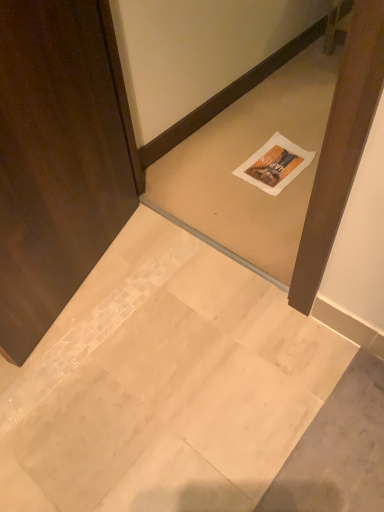
You are a GUI agent. You are given a task and a screenshot of the screen. Output one action in this format:
    pyautogui.click(x=<x>, y=<y>)
    Task: Click on the white paper magazine at center
    Image resolution: width=384 pixels, height=512 pixels.
    Given the screenshot: What is the action you would take?
    pyautogui.click(x=275, y=164)

The width and height of the screenshot is (384, 512). Describe the element at coordinates (275, 164) in the screenshot. I see `white paper magazine at center` at that location.

Locate an element on the screen. The image size is (384, 512). white paper magazine at center is located at coordinates (275, 164).